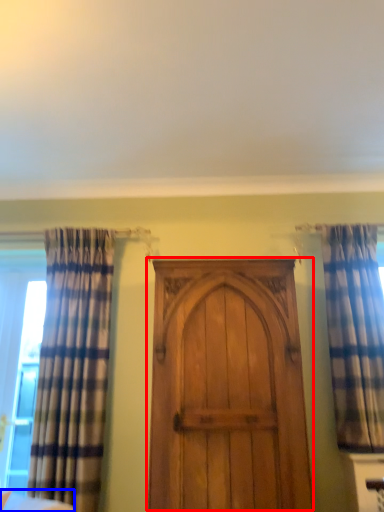
Question: Which object appears farthest to the camera in this image, door (highlighted by a red box) or furniture (highlighted by a blue box)?

Choices:
 (A) door
 (B) furniture

Answer: (A)